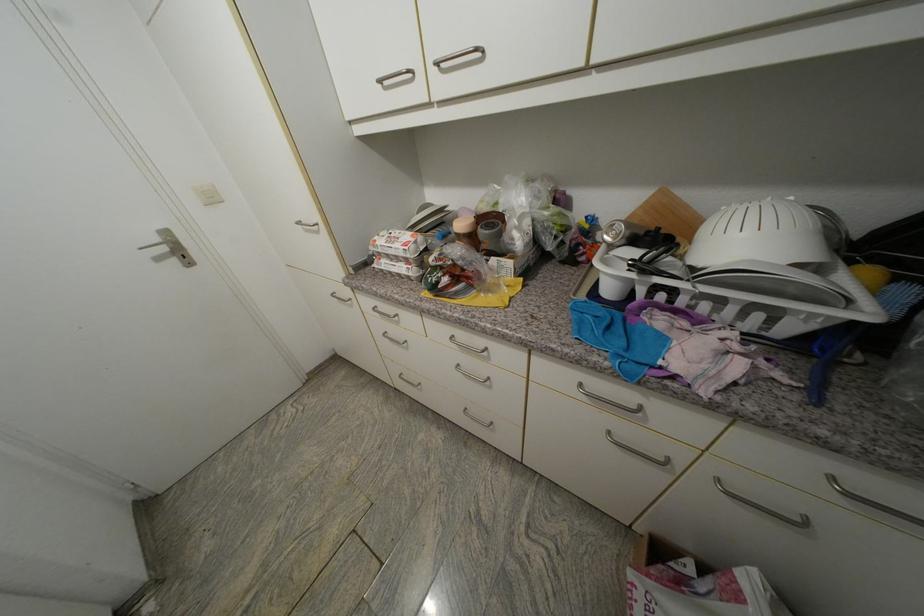
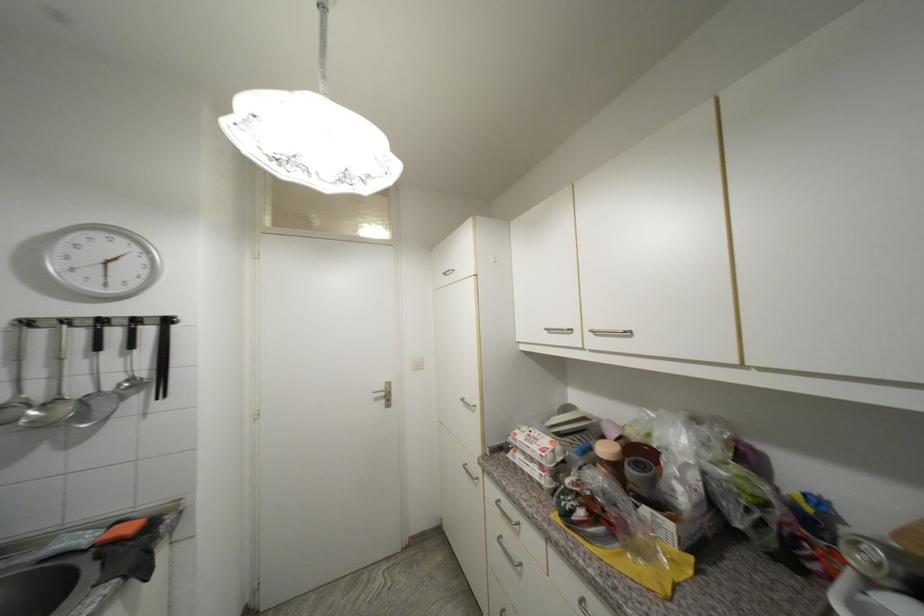
Locate, in the second image, the point that corresponds to point (496, 221) in the first image.

(648, 456)